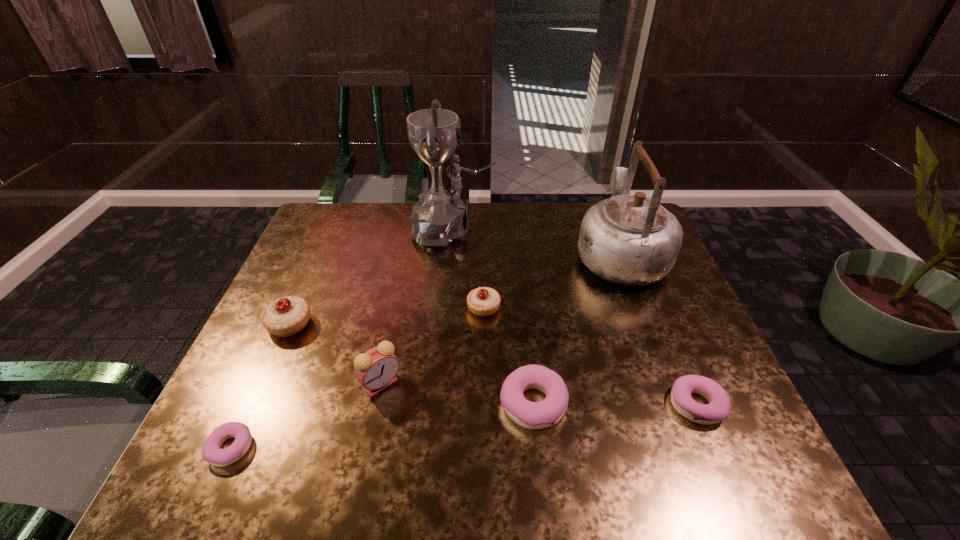
Image resolution: width=960 pixels, height=540 pixels. I want to click on vacant space in between the kettle and the bigger beige pastry, so click(455, 289).

At what (x,y) coordinates should I click in order to perform the action: click on vacant space in between the smaller beige pastry and the seventh shortest object. Please return your answer as a coordinate pair (x, y). Looking at the image, I should click on (552, 281).

Locate an element on the screen. This screenshot has width=960, height=540. empty space that is in between the kettle and the bigger beige pastry is located at coordinates (455, 289).

This screenshot has width=960, height=540. In order to click on vacant space that's between the shortest pastry and the rightmost pink pastry in this screenshot , I will do `click(464, 426)`.

What are the coordinates of `the seventh closest object to the award` in the screenshot? It's located at (212, 453).

Find the location of a particular element. Image resolution: width=960 pixels, height=540 pixels. object that is the nearest to the second pink pastry from right to left is located at coordinates (484, 301).

Identify which pastry is the second closest to the third tallest pastry. Please provide its 2D coordinates. Your answer should be formatted as a tuple, i.e. [(x, y)], where the tuple contains the x and y coordinates of a point satisfying the conditions above.

[(718, 409)]

Identify which pastry is located as the second nearest to the kettle. Please provide its 2D coordinates. Your answer should be formatted as a tuple, i.e. [(x, y)], where the tuple contains the x and y coordinates of a point satisfying the conditions above.

[(533, 415)]

Select which pink pastry appears as the third closest to the tallest object. Please provide its 2D coordinates. Your answer should be formatted as a tuple, i.e. [(x, y)], where the tuple contains the x and y coordinates of a point satisfying the conditions above.

[(212, 453)]

This screenshot has height=540, width=960. In order to click on pink pastry that is the second closest to the fourth shortest object in this screenshot , I will do `click(718, 409)`.